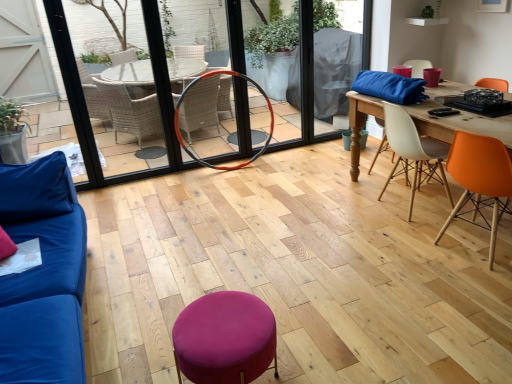
Question: From the image's perspective, would you say orange matte chair at right, which appears as the 2th chair when viewed from the back, is shown under blue fabric couch at left?

Choices:
 (A) no
 (B) yes

Answer: (A)

Question: Can you confirm if orange matte chair at right, the first chair in the front-to-back sequence, is positioned to the left of blue fabric couch at left?

Choices:
 (A) no
 (B) yes

Answer: (A)

Question: Does orange matte chair at right, the first chair in the front-to-back sequence, turn towards blue fabric couch at left?

Choices:
 (A) yes
 (B) no

Answer: (B)

Question: From a real-world perspective, is orange matte chair at right, which appears as the 2th chair when viewed from the back, beneath blue fabric couch at left?

Choices:
 (A) no
 (B) yes

Answer: (B)

Question: Can you confirm if orange matte chair at right, which appears as the 2th chair when viewed from the back, is wider than blue fabric couch at left?

Choices:
 (A) no
 (B) yes

Answer: (A)

Question: Is purple fabric stool at center inside the boundaries of orange rubber hula hoop at center, or outside?

Choices:
 (A) inside
 (B) outside

Answer: (B)

Question: From a real-world perspective, is purple fabric stool at center positioned above or below orange rubber hula hoop at center?

Choices:
 (A) above
 (B) below

Answer: (B)

Question: Considering the positions of point (219, 319) and point (270, 135), is point (219, 319) closer or farther from the camera than point (270, 135)?

Choices:
 (A) farther
 (B) closer

Answer: (B)

Question: Looking at the image, does purple fabric stool at center seem bigger or smaller compared to orange rubber hula hoop at center?

Choices:
 (A) small
 (B) big

Answer: (A)

Question: Is blue fabric couch at left taller or shorter than white plastic chair at center right, the second chair when ordered from front to back?

Choices:
 (A) tall
 (B) short

Answer: (A)

Question: Is blue fabric couch at left wider or thinner than white plastic chair at center right, acting as the 1th chair starting from the back?

Choices:
 (A) thin
 (B) wide

Answer: (B)

Question: From the image's perspective, relative to white plastic chair at center right, the second chair when ordered from front to back, is blue fabric couch at left above or below?

Choices:
 (A) below
 (B) above

Answer: (A)

Question: Relative to white plastic chair at center right, the second chair when ordered from front to back, is blue fabric couch at left in front or behind?

Choices:
 (A) front
 (B) behind

Answer: (A)

Question: Is orange rubber hula hoop at center taller or shorter than white plastic chair at center right, acting as the 1th chair starting from the back?

Choices:
 (A) short
 (B) tall

Answer: (B)

Question: Does point (232, 72) appear closer or farther from the camera than point (421, 165)?

Choices:
 (A) farther
 (B) closer

Answer: (A)